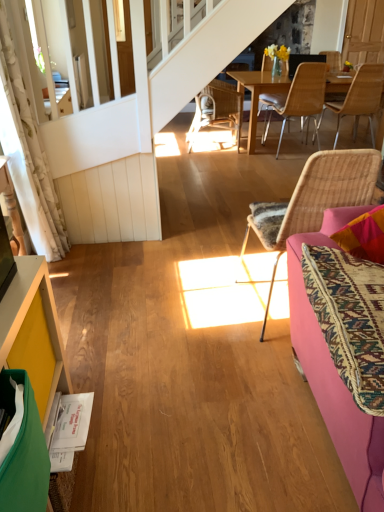
Locate an element on the screen. This screenshot has height=512, width=384. free space to the right of white floral fabric curtain at left is located at coordinates (95, 254).